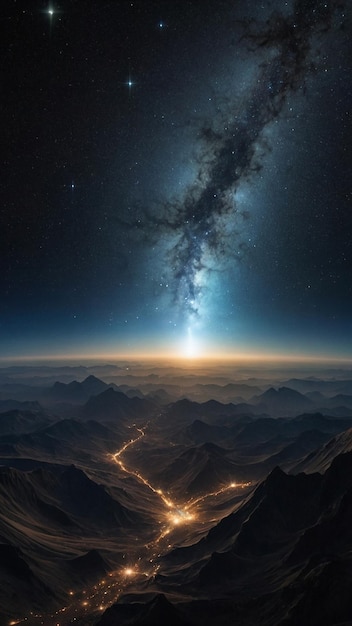
Where is `light`? light is located at coordinates (190, 352), (175, 521), (190, 518), (127, 571), (234, 484).